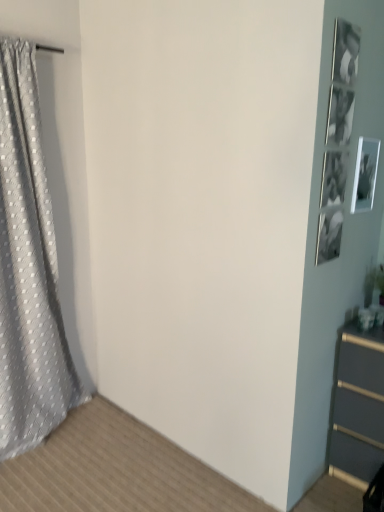
Question: Based on their positions, is white glossy picture frame at upper right located to the left or right of gray textured curtain at left?

Choices:
 (A) left
 (B) right

Answer: (B)

Question: Is white glossy picture frame at upper right inside the boundaries of gray textured curtain at left, or outside?

Choices:
 (A) inside
 (B) outside

Answer: (B)

Question: From the image's perspective, is white glossy picture frame at upper right positioned above or below gray textured curtain at left?

Choices:
 (A) below
 (B) above

Answer: (B)

Question: From a real-world perspective, relative to white glossy picture frame at upper right, is gray textured curtain at left vertically above or below?

Choices:
 (A) below
 (B) above

Answer: (A)

Question: Looking at their shapes, would you say gray textured curtain at left is wider or thinner than white glossy picture frame at upper right?

Choices:
 (A) thin
 (B) wide

Answer: (B)

Question: Based on their sizes in the image, would you say gray textured curtain at left is bigger or smaller than white glossy picture frame at upper right?

Choices:
 (A) small
 (B) big

Answer: (B)

Question: Does point (11, 84) appear closer or farther from the camera than point (367, 179)?

Choices:
 (A) farther
 (B) closer

Answer: (A)